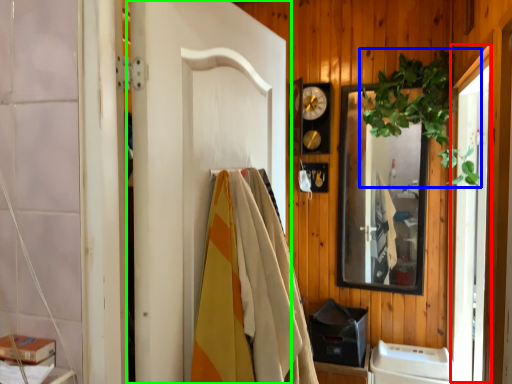
Question: Estimate the real-world distances between objects in this image. Which object is farther from screen door (highlighted by a red box), plant (highlighted by a blue box) or door (highlighted by a green box)?

Choices:
 (A) plant
 (B) door

Answer: (B)